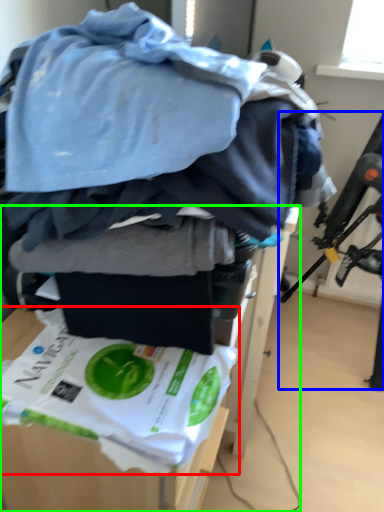
Question: Which is nearer to the waste (highlighted by a red box)? swivel chair (highlighted by a blue box) or furniture (highlighted by a green box).

Choices:
 (A) swivel chair
 (B) furniture

Answer: (B)